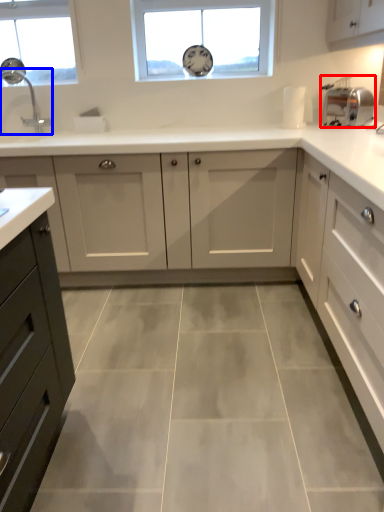
Question: Which of the following is the farthest to the observer, appliance (highlighted by a red box) or tap (highlighted by a blue box)?

Choices:
 (A) appliance
 (B) tap

Answer: (B)